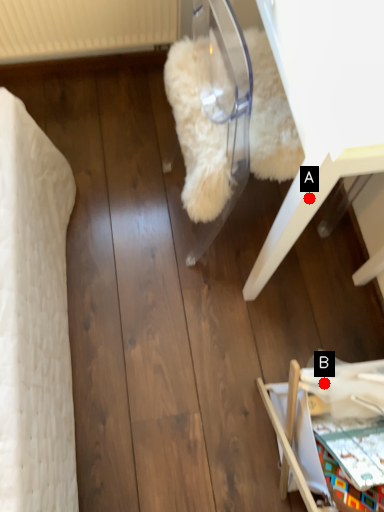
Question: Two points are circled on the image, labeled by A and B beside each circle. Which of the following is the farthest from the observer?

Choices:
 (A) A is further
 (B) B is further

Answer: (B)